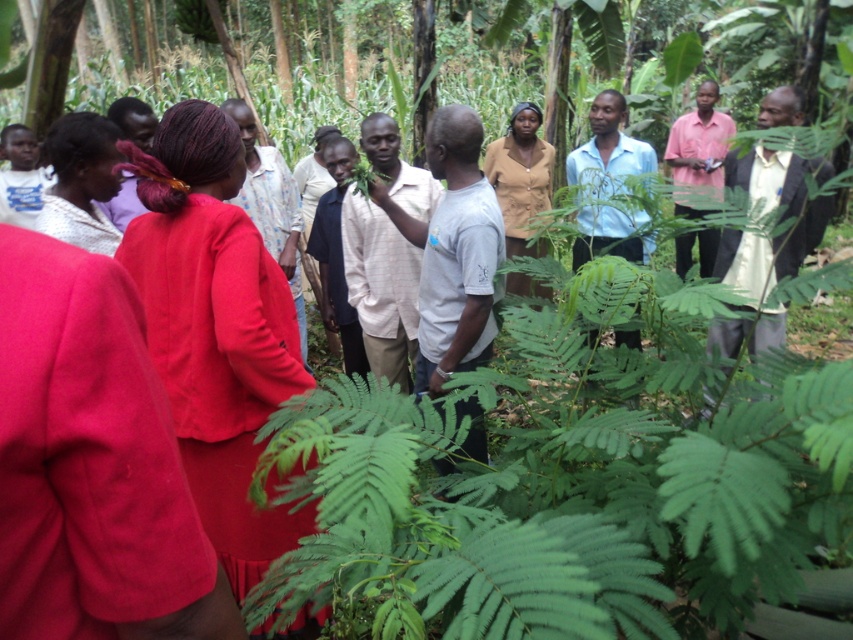
Question: Among these objects, which one is farthest from the camera?

Choices:
 (A) matte brown shirt at center
 (B) light pink shirt at right
 (C) matte red dress at center
 (D) matte white shirt at center

Answer: (A)

Question: Which object is the farthest from the matte red dress at center?

Choices:
 (A) pink matte shirt at right
 (B) matte brown shirt at center
 (C) matte white shirt at center
 (D) green leafy fern at center

Answer: (A)

Question: Observing the image, what is the correct spatial positioning of light pink shirt at right in reference to pink matte shirt at right?

Choices:
 (A) left
 (B) right

Answer: (A)

Question: Among these objects, which one is nearest to the camera?

Choices:
 (A) pink matte shirt at right
 (B) light pink shirt at right
 (C) matte brown shirt at center
 (D) matte red dress at center

Answer: (D)

Question: Is matte red dress at center smaller than matte brown shirt at center?

Choices:
 (A) yes
 (B) no

Answer: (A)

Question: From the image, what is the correct spatial relationship of green leafy fern at center in relation to light pink shirt at right?

Choices:
 (A) below
 (B) above

Answer: (A)